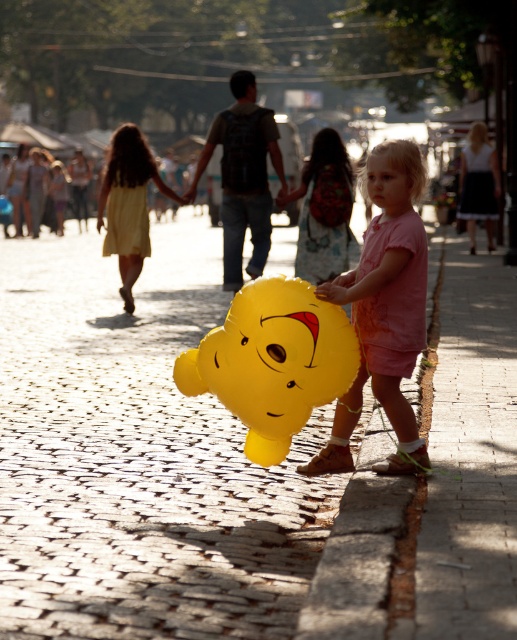
You are a photographer trying to capture a closeup shot of the yellow balloon at center and the smooth skin face at center. Which object is wider in the image?

The yellow balloon at center is wider than the smooth skin face at center.

You are a photographer standing at the center of the street. You want to take a picture of the yellow balloon at center. Where should you aim your camera to capture it?

The yellow balloon at center is located at point 0.733 on the x axis and 0.319 on the y axis, so you should aim your camera at those coordinates to capture it.